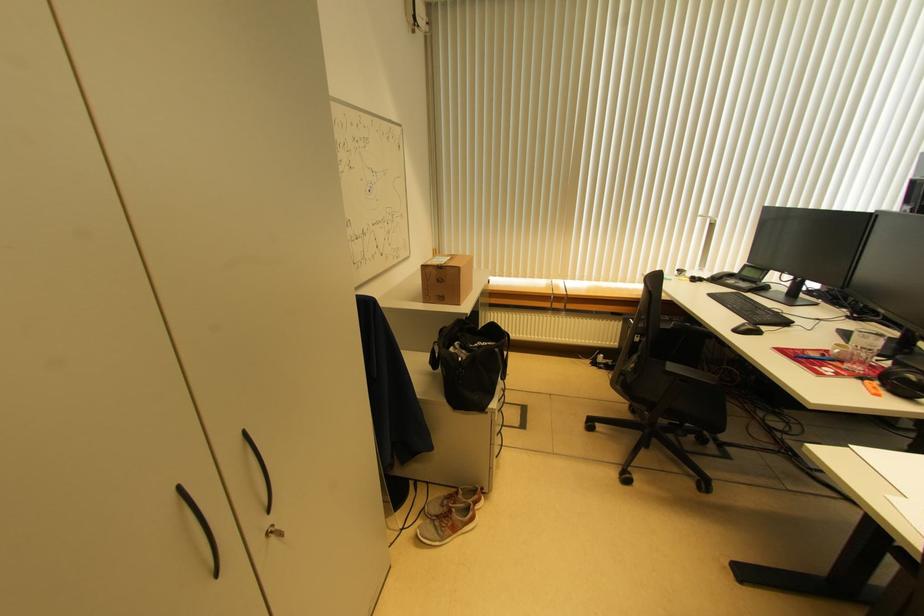
Locate an element on the screen. The height and width of the screenshot is (616, 924). chair armrest is located at coordinates (711, 358).